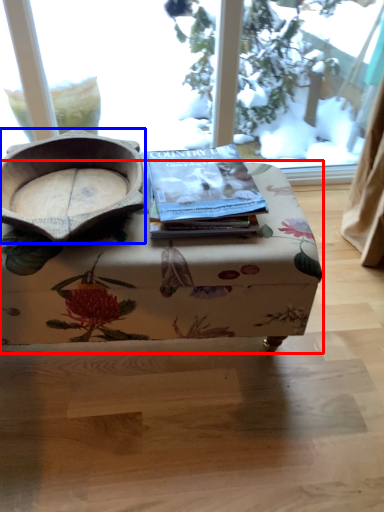
Question: Which point is closer to the camera, table (highlighted by a red box) or bowl (highlighted by a blue box)?

Choices:
 (A) table
 (B) bowl

Answer: (B)